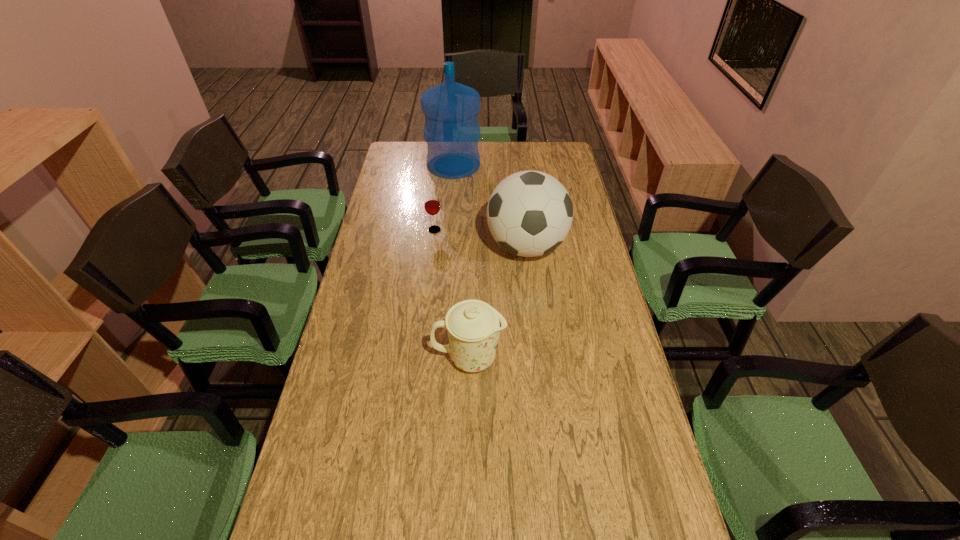
This screenshot has height=540, width=960. In order to click on the farthest object in this screenshot , I will do `click(451, 131)`.

You are a GUI agent. You are given a task and a screenshot of the screen. Output one action in this format:
    pyautogui.click(x=<x>, y=<y>)
    Task: Click on the tallest object
    
    Given the screenshot: What is the action you would take?
    pyautogui.click(x=451, y=131)

This screenshot has height=540, width=960. Identify the location of soccer ball. (529, 213).

This screenshot has height=540, width=960. I want to click on the nearest object, so click(473, 326).

This screenshot has width=960, height=540. Find the location of `the second shortest object`. the second shortest object is located at coordinates (473, 326).

Image resolution: width=960 pixels, height=540 pixels. Find the location of `glass`. glass is located at coordinates (432, 206).

Locate an element on the screen. vacant space located 0.170m on the left of the tallest object is located at coordinates (390, 165).

Identify the location of vacant position located 0.240m on the front of the third shortest object. (536, 330).

Image resolution: width=960 pixels, height=540 pixels. In order to click on vacant space located 0.310m on the spout of the chinaware in this screenshot , I will do `click(612, 357)`.

Find the location of `vacant region located on the back of the shortest object`. vacant region located on the back of the shortest object is located at coordinates (438, 198).